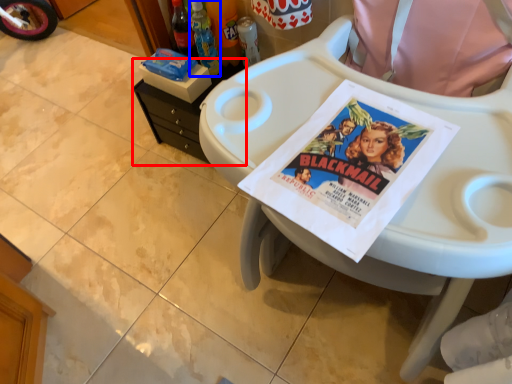
Question: Which of the following is the farthest to the observer, changing table (highlighted by a red box) or bottle (highlighted by a blue box)?

Choices:
 (A) changing table
 (B) bottle

Answer: (A)